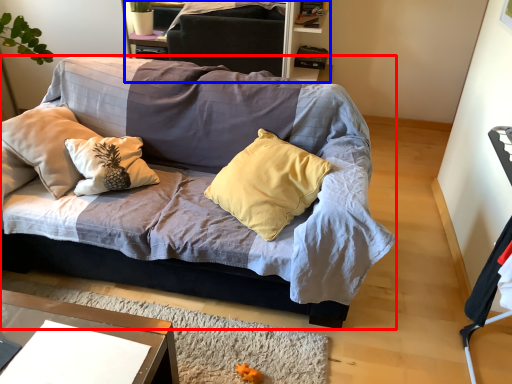
Question: Which of the following is the farthest to the observer, studio couch (highlighted by a red box) or dresser (highlighted by a blue box)?

Choices:
 (A) studio couch
 (B) dresser

Answer: (B)